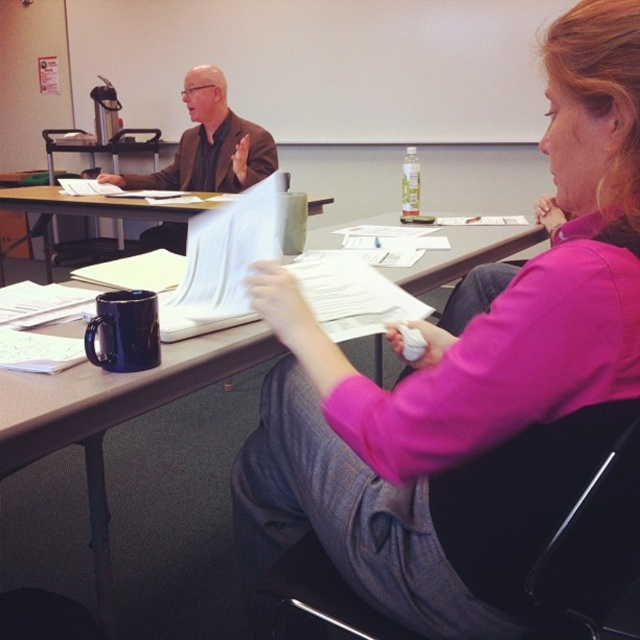
In the scene shown: You are organizing a meeting in the classroom and need to place a name tag for the presenter. The presenter is wearing the matte brown jacket at upper left. Where should you place the name tag relative to the matte black mug at center?

The matte brown jacket at upper left is to the left of the matte black mug at center, so you should place the name tag to the left of the matte black mug at center.

Please provide the 2D coordinates of the matte black mug at center in the image. The coordinates should be in the format of a point with two decimal places, like this example format point format is like this example format point format is like this example format point format is like this example format point format is like this example format point format is like this example format point format is like this example format point format is like this example format point format is like this example format.

The 2D coordinates of the matte black mug at center are point at point at point at point at point at point at point at point at point at point at point at point at point at point at point at point at point at point at point at point at point at point at point at point at point at point at point at point at point at point at point at point at point at point at point at point at point at point at point at point at point at point at point at point at point at point at point at point at point at point at point.

Based on the scene description, where is the pink fabric shirt at center located in terms of its 2D coordinates?

The pink fabric shirt at center is located at the 2D coordinates point (468,388).